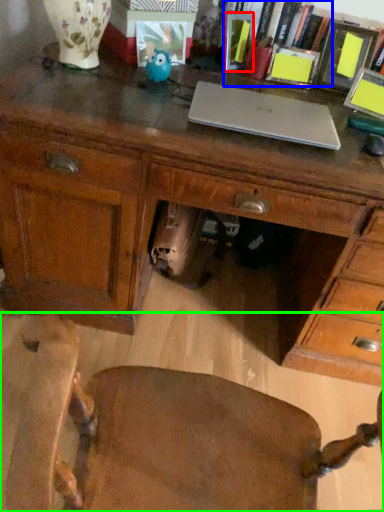
Question: Which object is the farthest from book (highlighted by a red box)? Choose among these: book (highlighted by a blue box) or chair (highlighted by a green box).

Choices:
 (A) book
 (B) chair

Answer: (B)